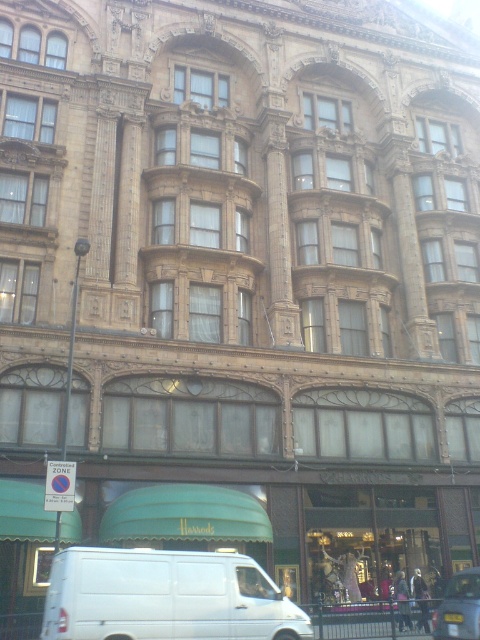
You are standing in front of the grand building and want to walk from the point at coordinates point (224, 608) to the point at coordinates point (463, 611). Will you move towards the upper part of the building?

Yes, moving from point (224, 608) to point (463, 611) means moving towards the upper part of the building since point (463, 611) is located higher up compared to point (224, 608).

You are a delivery person trying to park your vehicle in the parking lot adjacent to the grand building. You have a white matte van at lower center and a metallic silver car at lower right. Which vehicle is wider and would require more space to park?

The white matte van at lower center is wider than the metallic silver car at lower right, so it would require more space to park.

You are standing in front of the grand building and see a white matte van at lower center and a metallic silver car at lower right. Which vehicle is positioned closer to the entrance of the building?

The white matte van at lower center is positioned to the left of the metallic silver car at lower right, so it is closer to the entrance of the building.